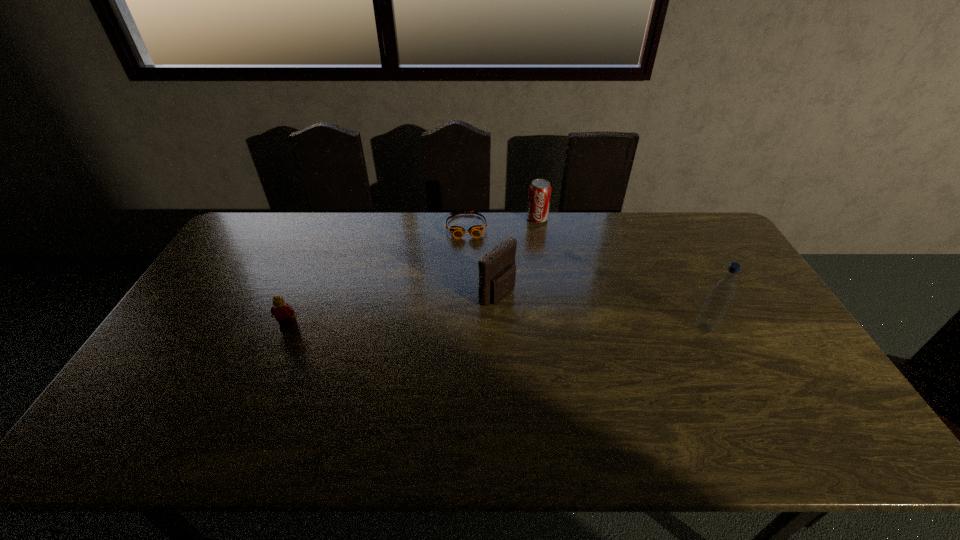
Where is `free space between the water bottle and the soda can`? This screenshot has height=540, width=960. free space between the water bottle and the soda can is located at coordinates (621, 273).

This screenshot has width=960, height=540. Identify the location of vacant space that is in between the pouch and the third tallest object. (516, 256).

In order to click on vacant region between the leftmost object and the water bottle in this screenshot , I will do `click(496, 327)`.

At what (x,y) coordinates should I click in order to perform the action: click on free space between the tallest object and the third farthest object. Please return your answer as a coordinate pair (x, y). The width and height of the screenshot is (960, 540). Looking at the image, I should click on (601, 311).

Image resolution: width=960 pixels, height=540 pixels. Identify the location of free space between the third farthest object and the rightmost object. (601, 311).

Image resolution: width=960 pixels, height=540 pixels. In order to click on vacant space that's between the Lego and the third shortest object in this screenshot , I will do `click(413, 272)`.

The image size is (960, 540). I want to click on blank region between the soda can and the goggles, so pyautogui.click(x=502, y=223).

The image size is (960, 540). In order to click on vacant area between the leftmost object and the water bottle in this screenshot , I will do [496, 327].

Image resolution: width=960 pixels, height=540 pixels. Identify the location of vacant space that is in between the third shortest object and the Lego. (413, 272).

Choose which object is the third nearest neighbor to the soda can. Please provide its 2D coordinates. Your answer should be formatted as a tuple, i.e. [(x, y)], where the tuple contains the x and y coordinates of a point satisfying the conditions above.

[(722, 291)]